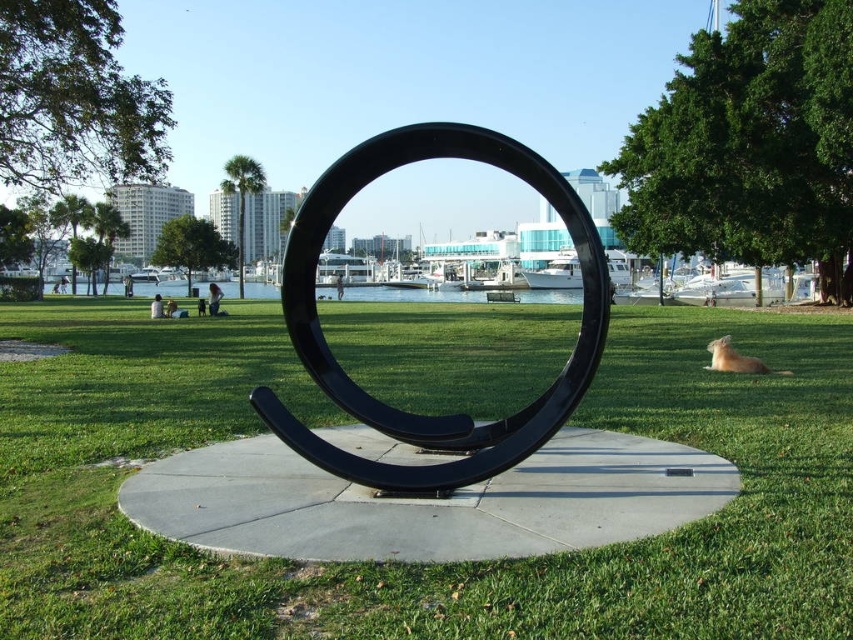
You are standing in the park and want to take a photo of the black matte horseshoe at center. If your camera can focus on objects up to 5 meters away, will you need to move closer or farther away to get a clear shot?

The black matte horseshoe at center is 5.13 meters away from you. Since your camera can focus up to 5 meters, you need to move closer to ensure it is within the 5 meter range for clear focus.

You are standing in the park and want to take a photo of the black matte horseshoe at center and the dark blue jeans at center. Which object should you focus on first to ensure both are in the same frame?

You should focus on the black matte horseshoe at center first since it is closer to the viewer than the dark blue jeans at center, allowing both to be captured in the same frame.